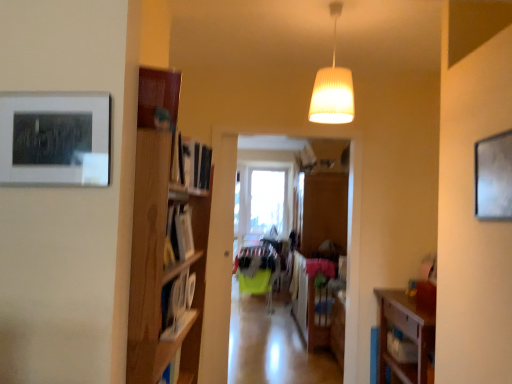
Question: Considering the positions of wooden clothes rack at center and matte black picture frame at upper left, which is the first picture frame from front to back, in the image, is wooden clothes rack at center wider or thinner than matte black picture frame at upper left, which is the first picture frame from front to back,?

Choices:
 (A) wide
 (B) thin

Answer: (B)

Question: From the image's perspective, relative to matte black picture frame at upper left, the 2th picture frame in the right-to-left sequence, is wooden clothes rack at center above or below?

Choices:
 (A) below
 (B) above

Answer: (A)

Question: Considering the real-world distances, which object is farthest from the wooden clothes rack at center?

Choices:
 (A) white glossy bookshelf at left
 (B) transparent glass window at center
 (C) green fabric chair at center
 (D) wooden floor at center
 (E) matte gray picture frame at upper right, marked as the 2th picture frame in a left-to-right arrangement

Answer: (E)

Question: Which of these objects is positioned farthest from the white glossy bookshelf at left?

Choices:
 (A) matte gray picture frame at upper right, placed as the first picture frame when sorted from back to front
 (B) white ribbed lampshade at upper center
 (C) transparent glass window at center
 (D) wooden floor at center
 (E) wooden clothes rack at center

Answer: (C)